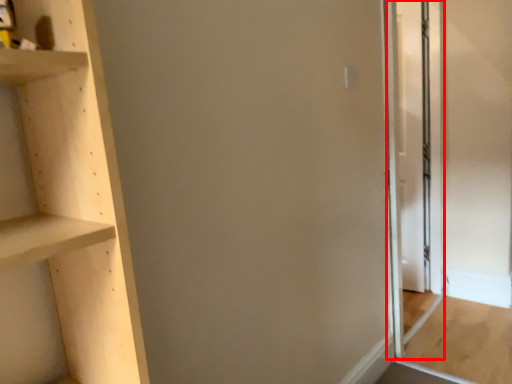
Question: From the image, what is the correct spatial relationship of screen door (annotated by the red box) in relation to plywood?

Choices:
 (A) right
 (B) left

Answer: (B)